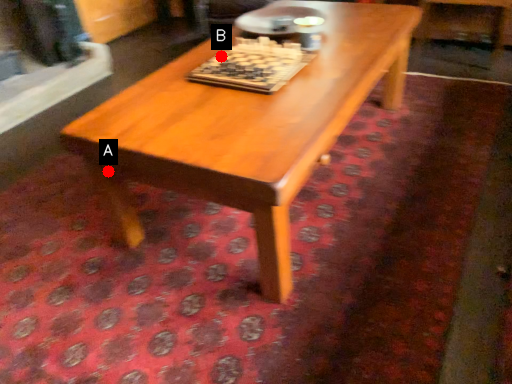
Question: Two points are circled on the image, labeled by A and B beside each circle. Which point is closer to the camera taking this photo?

Choices:
 (A) A is closer
 (B) B is closer

Answer: (A)